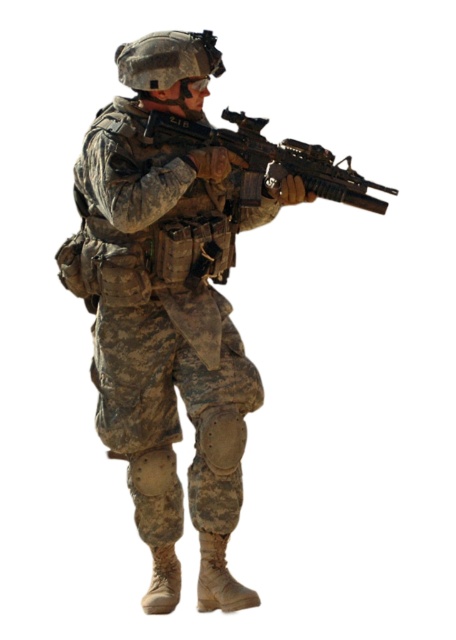
You are a military equipment inspector checking the soldier in the image. You need to determine if the camouflage fabric uniform at center can be worn over the matte black rifle at center without any issues. Based on their sizes, can the uniform be worn over the rifle?

The camouflage fabric uniform at center is taller than the matte black rifle at center, so yes, the uniform can be worn over the rifle since it is taller and would not interfere with the rifle.

Based on the scene description, where is the camouflage fabric uniform at center located in the image?

The camouflage fabric uniform at center is located at point (155, 308) in the image.

You are a drone operator controlling a drone that needs to maintain a minimum distance of 5 meters from any object to avoid detection. You are currently positioned above the soldier in the image. Is the camouflage fabric uniform at center within the safe distance required by your drone?

The camouflage fabric uniform at center is only 4.60 meters away from the camera, which is below the required 5 meters minimum distance. Therefore, the drone is too close and might be detected.